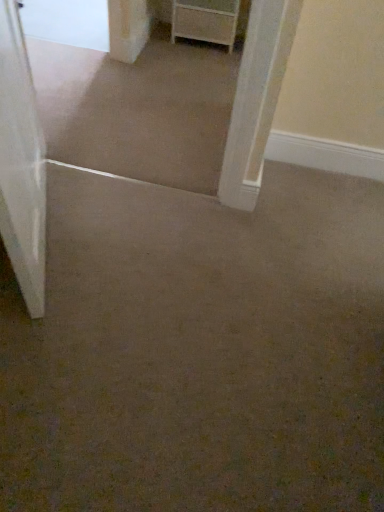
Question: Is white matte chest of drawers at upper center positioned beyond the bounds of white matte door at left?

Choices:
 (A) no
 (B) yes

Answer: (B)

Question: Is white matte chest of drawers at upper center bigger than white matte door at left?

Choices:
 (A) no
 (B) yes

Answer: (A)

Question: Does white matte chest of drawers at upper center have a lesser width compared to white matte door at left?

Choices:
 (A) yes
 (B) no

Answer: (B)

Question: From a real-world perspective, is white matte chest of drawers at upper center positioned over white matte door at left based on gravity?

Choices:
 (A) no
 (B) yes

Answer: (A)

Question: Is white matte door at left a part of white matte chest of drawers at upper center?

Choices:
 (A) yes
 (B) no

Answer: (B)

Question: Considering the relative positions of white matte chest of drawers at upper center and white matte door at left in the image provided, is white matte chest of drawers at upper center to the left of white matte door at left from the viewer's perspective?

Choices:
 (A) no
 (B) yes

Answer: (A)

Question: Are white matte door at left and white matte chest of drawers at upper center located far from each other?

Choices:
 (A) no
 (B) yes

Answer: (B)

Question: Can you confirm if white matte door at left is taller than white matte chest of drawers at upper center?

Choices:
 (A) no
 (B) yes

Answer: (B)

Question: Is white matte door at left with white matte chest of drawers at upper center?

Choices:
 (A) no
 (B) yes

Answer: (A)

Question: Can you confirm if white matte door at left is positioned to the right of white matte chest of drawers at upper center?

Choices:
 (A) no
 (B) yes

Answer: (A)

Question: Considering the relative positions of white matte door at left and white matte chest of drawers at upper center in the image provided, is white matte door at left to the left of white matte chest of drawers at upper center from the viewer's perspective?

Choices:
 (A) no
 (B) yes

Answer: (B)

Question: Is white matte door at left thinner than white matte chest of drawers at upper center?

Choices:
 (A) yes
 (B) no

Answer: (A)

Question: Is point (190, 36) positioned closer to the camera than point (1, 38)?

Choices:
 (A) closer
 (B) farther

Answer: (B)